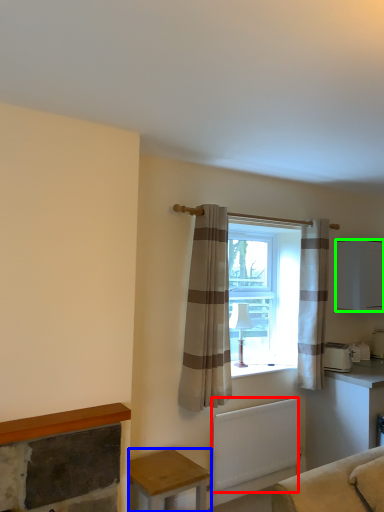
Question: Which object is positioned farthest from radiator (highlighted by a red box)? Select from table (highlighted by a blue box) and cabinetry (highlighted by a green box).

Choices:
 (A) table
 (B) cabinetry

Answer: (B)